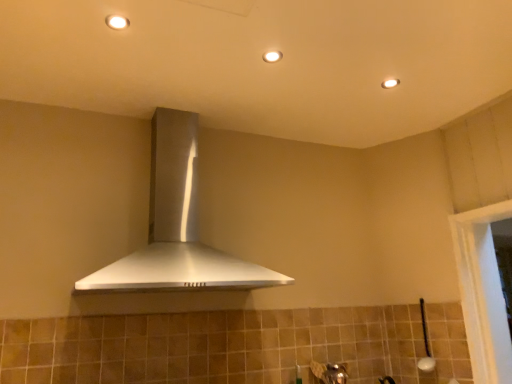
Question: Is matte white light fixture at upper center, positioned as the 3th light fixture in front-to-back order, surrounding white glossy light fixture at upper center, marked as the 3th light fixture in a back-to-front arrangement?

Choices:
 (A) yes
 (B) no

Answer: (B)

Question: Is matte white light fixture at upper center, positioned as the first light fixture in right-to-left order, smaller than white glossy light fixture at upper center, which is counted as the 3th light fixture, starting from the right?

Choices:
 (A) no
 (B) yes

Answer: (B)

Question: Is matte white light fixture at upper center, positioned as the 3th light fixture in front-to-back order, looking in the opposite direction of white glossy light fixture at upper center, which is counted as the 3th light fixture, starting from the right?

Choices:
 (A) no
 (B) yes

Answer: (A)

Question: From the image's perspective, would you say matte white light fixture at upper center, positioned as the first light fixture in right-to-left order, is shown under white glossy light fixture at upper center, which ranks as the first light fixture in front-to-back order?

Choices:
 (A) no
 (B) yes

Answer: (B)

Question: Is matte white light fixture at upper center, which is counted as the first light fixture, starting from the bottom, oriented towards white glossy light fixture at upper center, acting as the first light fixture starting from the top?

Choices:
 (A) yes
 (B) no

Answer: (B)

Question: From the image's perspective, is matte white light fixture at upper center, which is the second light fixture from bottom to top, located above or below satin silver range hood at center?

Choices:
 (A) above
 (B) below

Answer: (A)

Question: In terms of height, does matte white light fixture at upper center, positioned as the second light fixture in top-to-bottom order, look taller or shorter compared to satin silver range hood at center?

Choices:
 (A) tall
 (B) short

Answer: (B)

Question: From a real-world perspective, is matte white light fixture at upper center, the second light fixture viewed from the front, physically located above or below satin silver range hood at center?

Choices:
 (A) above
 (B) below

Answer: (A)

Question: Considering the positions of matte white light fixture at upper center, which is the second light fixture in back-to-front order, and satin silver range hood at center in the image, is matte white light fixture at upper center, which is the second light fixture in back-to-front order, wider or thinner than satin silver range hood at center?

Choices:
 (A) thin
 (B) wide

Answer: (A)

Question: Is satin silver range hood at center taller or shorter than white glossy light fixture at upper center, which ranks as the first light fixture in front-to-back order?

Choices:
 (A) tall
 (B) short

Answer: (A)

Question: Choose the correct answer: Is satin silver range hood at center inside white glossy light fixture at upper center, the first light fixture when ordered from left to right, or outside it?

Choices:
 (A) inside
 (B) outside

Answer: (B)

Question: Considering the positions of satin silver range hood at center and white glossy light fixture at upper center, marked as the 3th light fixture in a back-to-front arrangement, in the image, is satin silver range hood at center wider or thinner than white glossy light fixture at upper center, marked as the 3th light fixture in a back-to-front arrangement,?

Choices:
 (A) wide
 (B) thin

Answer: (A)

Question: Looking at the image, does satin silver range hood at center seem bigger or smaller compared to white glossy light fixture at upper center, the first light fixture when ordered from left to right?

Choices:
 (A) big
 (B) small

Answer: (A)

Question: Considering the positions of matte white light fixture at upper center, positioned as the third light fixture in left-to-right order, and white glossy light fixture at upper center, marked as the 3th light fixture in a back-to-front arrangement, in the image, is matte white light fixture at upper center, positioned as the third light fixture in left-to-right order, taller or shorter than white glossy light fixture at upper center, marked as the 3th light fixture in a back-to-front arrangement,?

Choices:
 (A) tall
 (B) short

Answer: (B)

Question: In terms of width, does matte white light fixture at upper center, the 1th light fixture positioned from the back, look wider or thinner when compared to white glossy light fixture at upper center, the first light fixture when ordered from left to right?

Choices:
 (A) thin
 (B) wide

Answer: (B)